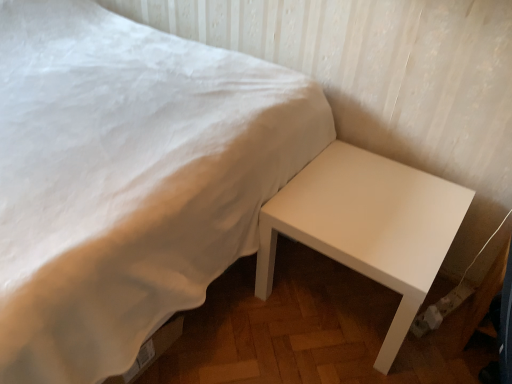
Identify the location of white glossy table at lower right. This screenshot has height=384, width=512. (367, 226).

The image size is (512, 384). Describe the element at coordinates (367, 226) in the screenshot. I see `white glossy table at lower right` at that location.

What do you see at coordinates (128, 179) in the screenshot? I see `white matte bed at lower right` at bounding box center [128, 179].

Find the location of a particular element. The image size is (512, 384). white matte bed at lower right is located at coordinates (128, 179).

Image resolution: width=512 pixels, height=384 pixels. I want to click on white glossy table at lower right, so [x=367, y=226].

Between white glossy table at lower right and white matte bed at lower right, which one appears on the right side from the viewer's perspective?

white glossy table at lower right.

Which object is more forward, white glossy table at lower right or white matte bed at lower right?

white matte bed at lower right is in front.

Which is closer to the camera, (273, 224) or (64, 181)?

The point (64, 181) is more forward.

From the image's perspective, is white glossy table at lower right over white matte bed at lower right?

Actually, white glossy table at lower right appears below white matte bed at lower right in the image.

From a real-world perspective, between white glossy table at lower right and white matte bed at lower right, who is vertically lower?

white glossy table at lower right.

Considering the sizes of objects white glossy table at lower right and white matte bed at lower right in the image provided, who is thinner, white glossy table at lower right or white matte bed at lower right?

Thinner between the two is white glossy table at lower right.

From their relative heights in the image, would you say white glossy table at lower right is taller or shorter than white matte bed at lower right?

Considering their sizes, white glossy table at lower right has less height than white matte bed at lower right.

Based on their sizes in the image, would you say white glossy table at lower right is bigger or smaller than white matte bed at lower right?

Clearly, white glossy table at lower right is smaller in size than white matte bed at lower right.

Is white glossy table at lower right completely or partially outside of white matte bed at lower right?

Absolutely, white glossy table at lower right is external to white matte bed at lower right.

Can you see white glossy table at lower right touching white matte bed at lower right?

white glossy table at lower right and white matte bed at lower right are not in contact.

Is white glossy table at lower right positioned with its back to white matte bed at lower right?

white glossy table at lower right is not turned away from white matte bed at lower right.

Identify the location of bed on the left of white glossy table at lower right. (128, 179).

Can you confirm if white matte bed at lower right is positioned to the right of white glossy table at lower right?

Incorrect, white matte bed at lower right is not on the right side of white glossy table at lower right.

From the picture: In the image, is white matte bed at lower right positioned in front of or behind white glossy table at lower right?

Visually, white matte bed at lower right is located in front of white glossy table at lower right.

Is point (76, 323) positioned in front of point (333, 237)?

Yes.

From the picture: From the image's perspective, is white matte bed at lower right under white glossy table at lower right?

No, from the image's perspective, white matte bed at lower right is not below white glossy table at lower right.

From a real-world perspective, between white matte bed at lower right and white glossy table at lower right, who is vertically higher?

In real-world perspective, white matte bed at lower right is above.

Considering the sizes of objects white matte bed at lower right and white glossy table at lower right in the image provided, who is thinner, white matte bed at lower right or white glossy table at lower right?

With smaller width is white glossy table at lower right.

Is white matte bed at lower right shorter than white glossy table at lower right?

No, white matte bed at lower right is not shorter than white glossy table at lower right.

Who is bigger, white matte bed at lower right or white glossy table at lower right?

white matte bed at lower right.

Is white glossy table at lower right inside white matte bed at lower right?

Actually, white glossy table at lower right is outside white matte bed at lower right.

Is white matte bed at lower right positioned far away from white glossy table at lower right?

No, white matte bed at lower right is in close proximity to white glossy table at lower right.

Is white matte bed at lower right positioned with its back to white glossy table at lower right?

That's not correct — white matte bed at lower right is not looking away from white glossy table at lower right.

You are a GUI agent. You are given a task and a screenshot of the screen. Output one action in this format:
    pyautogui.click(x=<x>, y=<y>)
    Task: Click on the bed lying on the left of white glossy table at lower right
    
    Given the screenshot: What is the action you would take?
    pyautogui.click(x=128, y=179)

What are the coordinates of `table located underneath the white matte bed at lower right (from a real-world perspective)` in the screenshot? It's located at (367, 226).

At what (x,y) coordinates should I click in order to perform the action: click on bed above the white glossy table at lower right (from the image's perspective). Please return your answer as a coordinate pair (x, y). Looking at the image, I should click on (128, 179).